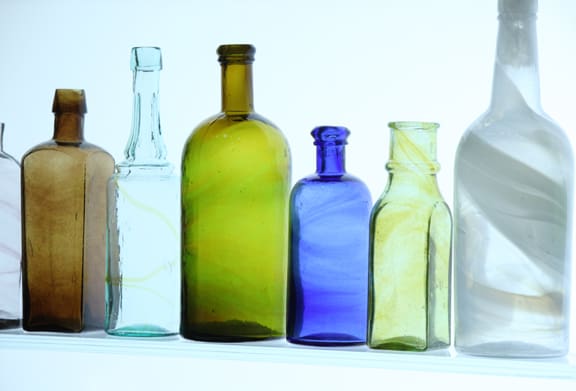
Image resolution: width=576 pixels, height=391 pixels. I want to click on glass bottle, so click(x=506, y=209), click(x=419, y=251), click(x=329, y=261), click(x=226, y=247), click(x=134, y=259), click(x=60, y=255), click(x=10, y=251).